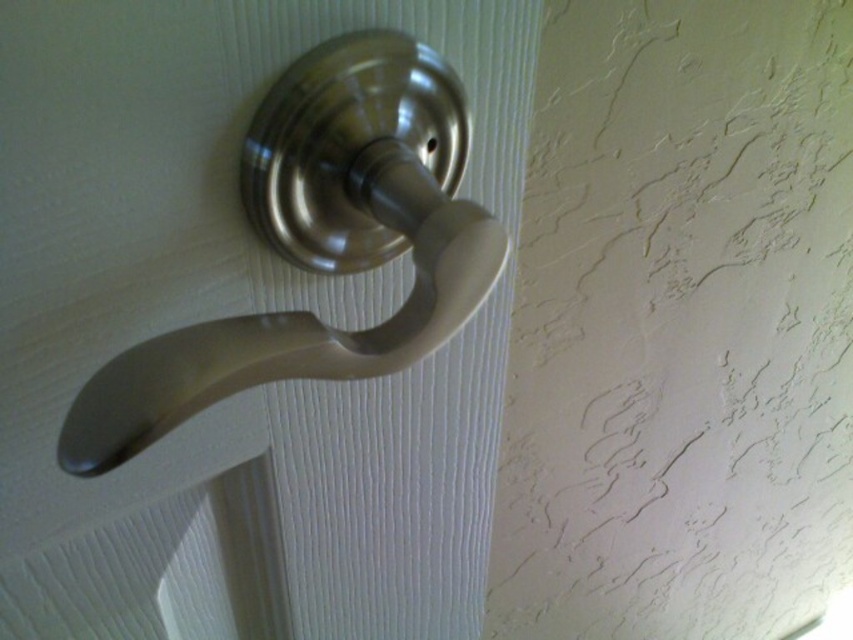
Is satin nickel handle at center smaller than satin nickel knob at center?

No.

Find the location of a particular element. The height and width of the screenshot is (640, 853). satin nickel handle at center is located at coordinates (252, 328).